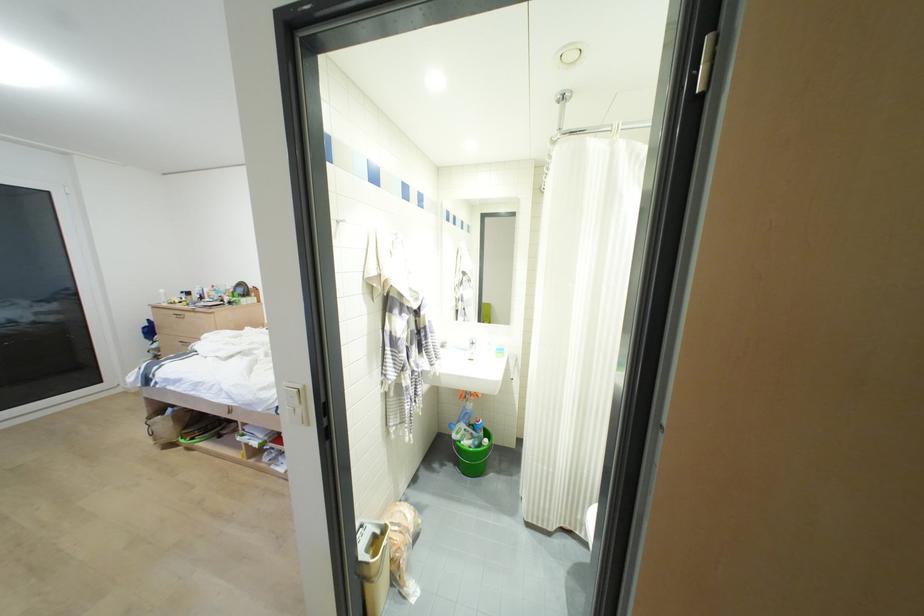
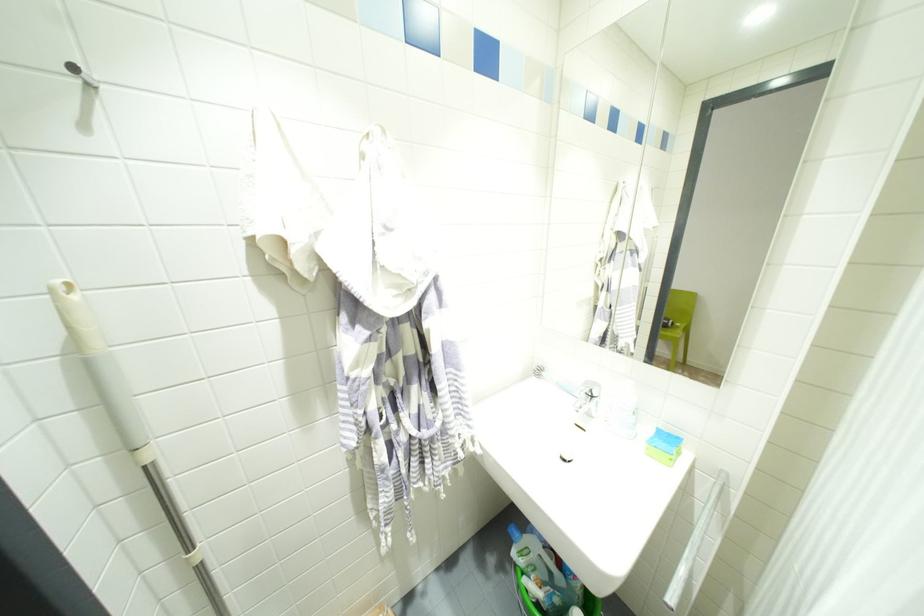
Locate, in the second image, the point that corresponds to the point at 454,436 in the first image.

(513, 553)